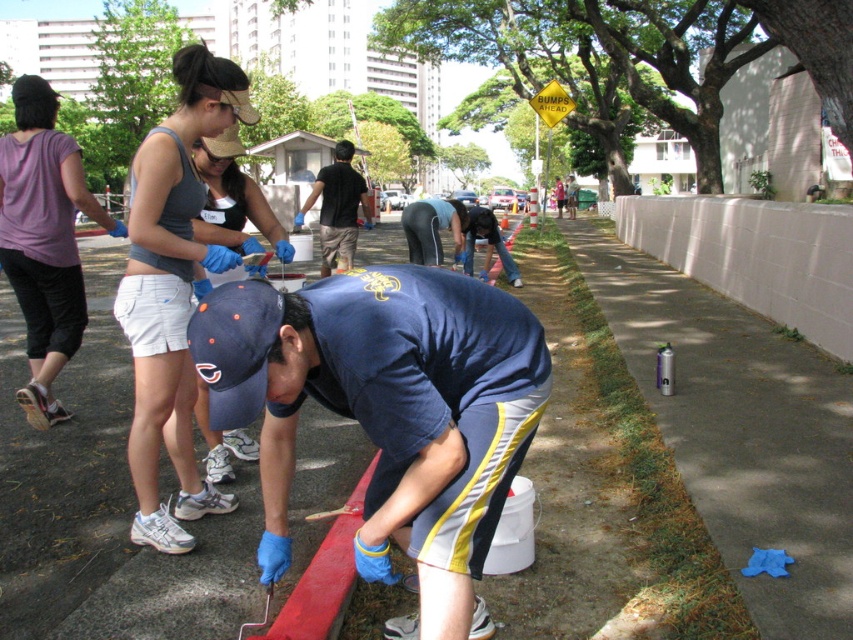
Question: From the image, what is the correct spatial relationship of red rubber curb at lower center in relation to dark blue shirt at center?

Choices:
 (A) below
 (B) above

Answer: (A)

Question: Which object is the closest to the blue fabric cap at center?

Choices:
 (A) matte black cap at center
 (B) blue denim jeans at center
 (C) dark blue shirt at center

Answer: (A)

Question: Which point is closer to the camera taking this photo?

Choices:
 (A) (465, 595)
 (B) (457, 234)
 (C) (236, 147)
 (D) (68, 180)

Answer: (A)

Question: Can you confirm if blue fabric cap at center is positioned to the left of red rubber curb at lower center?

Choices:
 (A) no
 (B) yes

Answer: (A)

Question: Which object is closer to the camera taking this photo?

Choices:
 (A) blue fabric cap at center
 (B) red rubber curb at lower center
 (C) blue denim jeans at center
 (D) dark blue shirt at center

Answer: (A)

Question: Is blue fabric cap at center bigger than dark blue shirt at center?

Choices:
 (A) no
 (B) yes

Answer: (A)